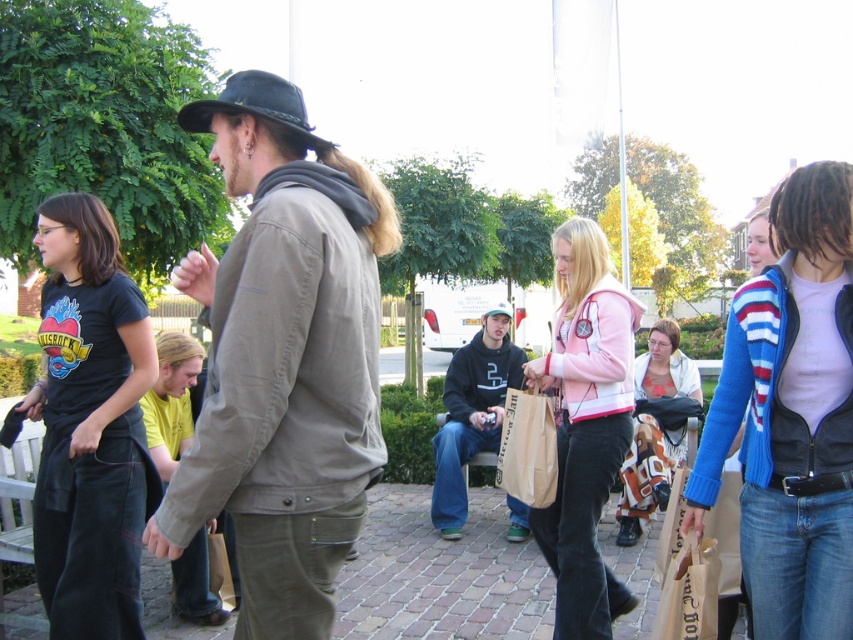
Who is lower down, black cotton t-shirt at left or black felt fedora at upper center?

black cotton t-shirt at left is below.

Where is `black cotton t-shirt at left`? black cotton t-shirt at left is located at coordinates (90, 426).

Which is behind, point (219, 634) or point (558, 490)?

Positioned behind is point (219, 634).

In the scene shown: Does brown brick pavement at center have a smaller size compared to pink fleece jacket at center?

→ Yes.

Which is behind, point (462, 556) or point (577, 284)?

Point (462, 556)

Identify the location of brown brick pavement at center. The width and height of the screenshot is (853, 640). (440, 576).

Can you confirm if khaki cotton jacket at center is positioned to the left of black felt hat at center?

Correct, you'll find khaki cotton jacket at center to the left of black felt hat at center.

Looking at this image, who is shorter, khaki cotton jacket at center or black felt hat at center?

A: With less height is black felt hat at center.

Which is in front, point (340, 413) or point (490, 304)?

Point (340, 413)

The height and width of the screenshot is (640, 853). In order to click on khaki cotton jacket at center in this screenshot , I will do point(283,358).